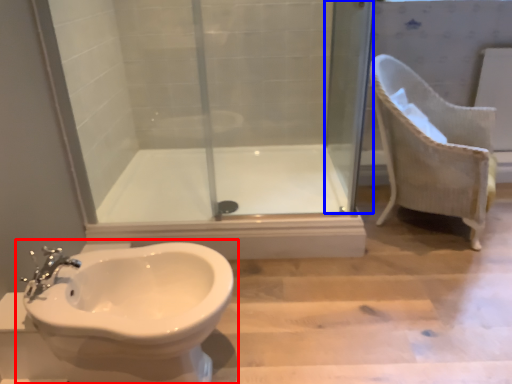
Question: Which point is further to the camera, toilet (highlighted by a red box) or screen door (highlighted by a blue box)?

Choices:
 (A) toilet
 (B) screen door

Answer: (B)